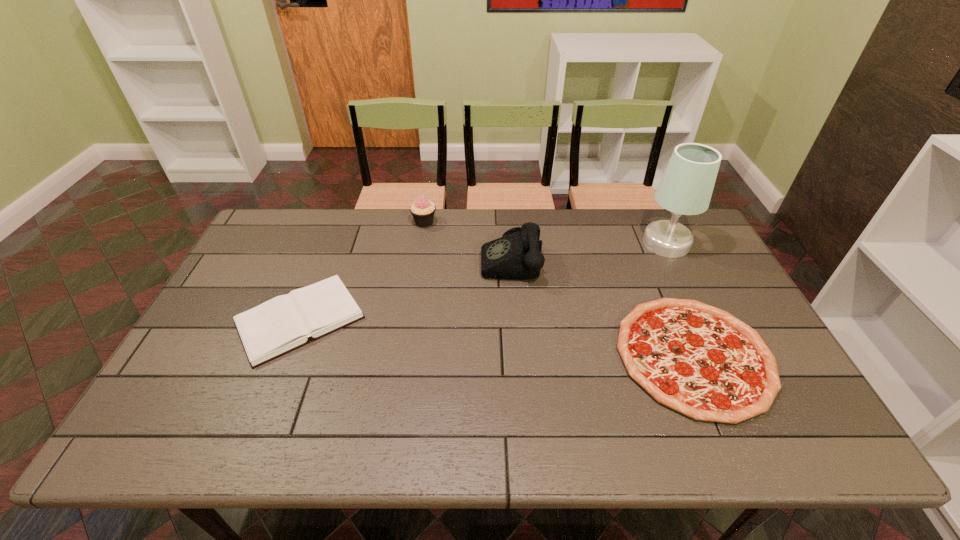
At what (x,y) coordinates should I click in order to perform the action: click on lampshade positioned at the right edge. Please return your answer as a coordinate pair (x, y). Looking at the image, I should click on (686, 187).

Identify the location of pizza positioned at the right edge. The height and width of the screenshot is (540, 960). (699, 360).

Identify the location of object present at the far right corner. The image size is (960, 540). (686, 187).

The image size is (960, 540). Find the location of `object that is at the near right corner`. object that is at the near right corner is located at coordinates (699, 360).

The image size is (960, 540). What are the coordinates of `vacant space at the far edge of the desktop` in the screenshot? It's located at (388, 242).

The width and height of the screenshot is (960, 540). Find the location of `vacant space at the near edge of the desktop`. vacant space at the near edge of the desktop is located at coordinates (522, 451).

This screenshot has height=540, width=960. In the image, there is a desktop. Find the location of `free region at the left edge`. free region at the left edge is located at coordinates (212, 393).

You are a GUI agent. You are given a task and a screenshot of the screen. Output one action in this format:
    pyautogui.click(x=<x>, y=<y>)
    Task: Click on the vacant space at the right edge of the desktop
    The image size is (960, 540).
    Given the screenshot: What is the action you would take?
    pyautogui.click(x=713, y=291)

Find the location of a particular element. free space that is in between the fourth object from right to left and the second shortest object is located at coordinates (362, 271).

You are a GUI agent. You are given a task and a screenshot of the screen. Output one action in this format:
    pyautogui.click(x=<x>, y=<y>)
    Task: Click on the free area in between the third object from right to left and the hardback book
    Image resolution: width=960 pixels, height=540 pixels.
    Given the screenshot: What is the action you would take?
    405,289